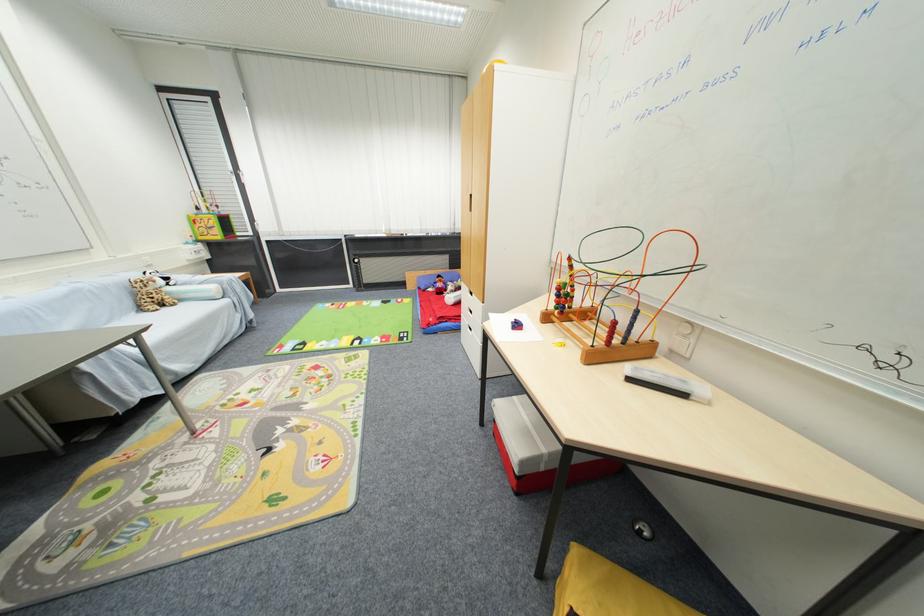
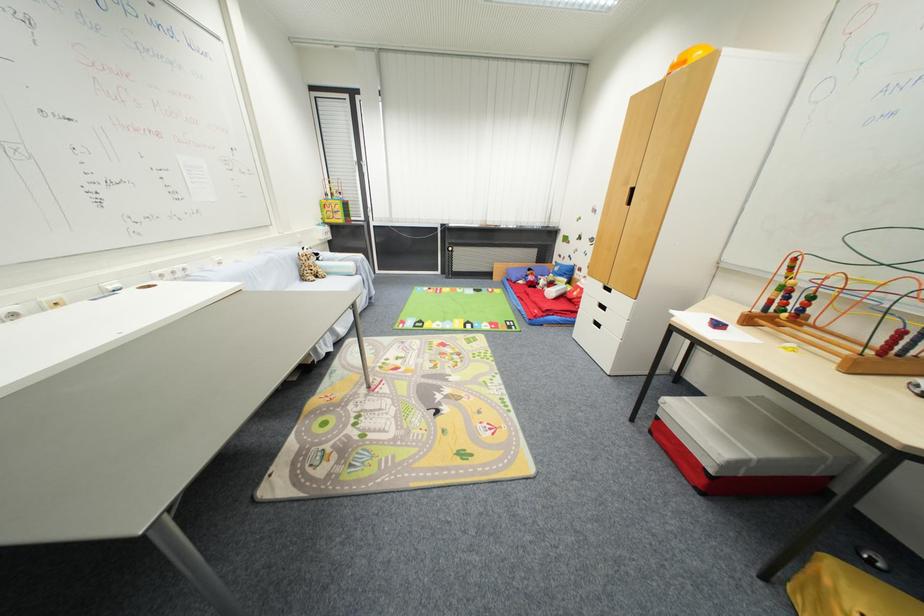
The point at (136, 306) is marked in the first image. Where is the corresponding point in the second image?

(300, 276)